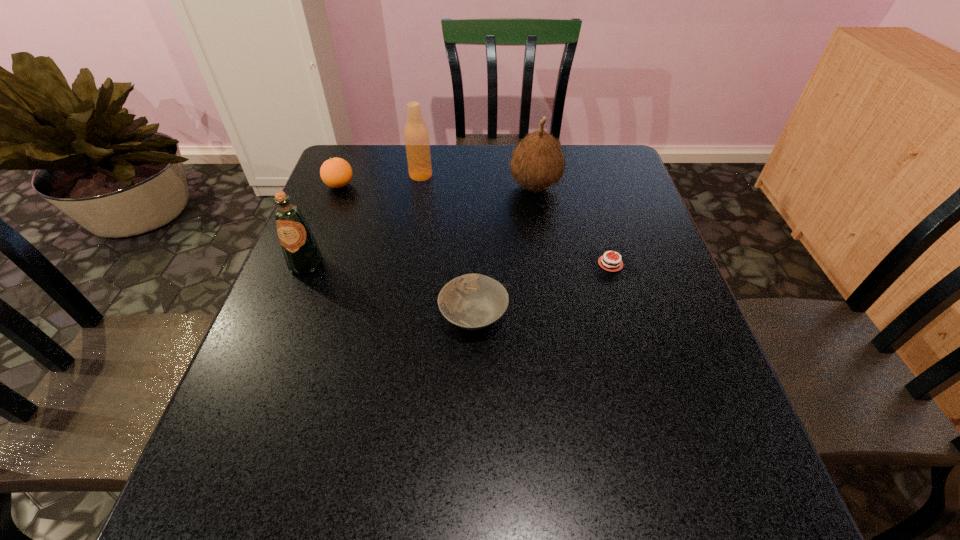
Where is `orange at the left edge`? orange at the left edge is located at coordinates (336, 172).

Where is `object present at the right edge`? The image size is (960, 540). object present at the right edge is located at coordinates (609, 264).

Locate an element on the screen. This screenshot has width=960, height=540. object located in the far left corner section of the desktop is located at coordinates (336, 172).

The image size is (960, 540). In the image, there is a desktop. What are the coordinates of `blank space at the far edge` in the screenshot? It's located at (393, 156).

In the image, there is a desktop. What are the coordinates of `vacant space at the near edge` in the screenshot? It's located at (612, 502).

Where is `free space at the right edge of the desktop`? Image resolution: width=960 pixels, height=540 pixels. free space at the right edge of the desktop is located at coordinates (596, 199).

The width and height of the screenshot is (960, 540). I want to click on vacant space at the near left corner, so click(197, 508).

What are the coordinates of `free space at the far right corner` in the screenshot? It's located at (618, 177).

Find the location of a particular element. vacant space at the near right corner of the desktop is located at coordinates (707, 511).

You are a GUI agent. You are given a task and a screenshot of the screen. Output one action in this format:
    pyautogui.click(x=<x>, y=<y>)
    Task: Click on the free space between the beer bottle and the rightmost object
    Image resolution: width=960 pixels, height=540 pixels.
    Given the screenshot: What is the action you would take?
    pyautogui.click(x=516, y=219)